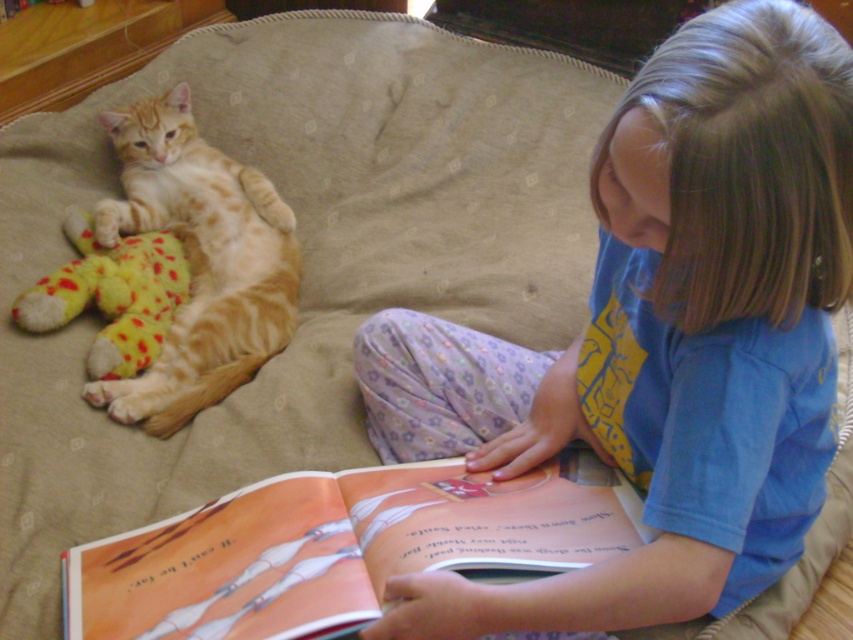
Question: Considering the real-world distances, which object is farthest from the matte orange book at lower center?

Choices:
 (A) blue cotton shirt at center
 (B) orange tabby cat at left

Answer: (B)

Question: Is matte orange book at lower center further to camera compared to orange tabby cat at left?

Choices:
 (A) yes
 (B) no

Answer: (B)

Question: Which object is the farthest from the blue cotton shirt at center?

Choices:
 (A) matte orange book at lower center
 (B) yellow plush toy at left

Answer: (B)

Question: Can you confirm if matte orange book at lower center is positioned above yellow plush toy at left?

Choices:
 (A) yes
 (B) no

Answer: (B)

Question: Is blue cotton shirt at center behind matte orange book at lower center?

Choices:
 (A) no
 (B) yes

Answer: (A)

Question: Which of these objects is positioned closest to the blue cotton shirt at center?

Choices:
 (A) yellow plush toy at left
 (B) matte orange book at lower center
 (C) orange tabby cat at left

Answer: (B)